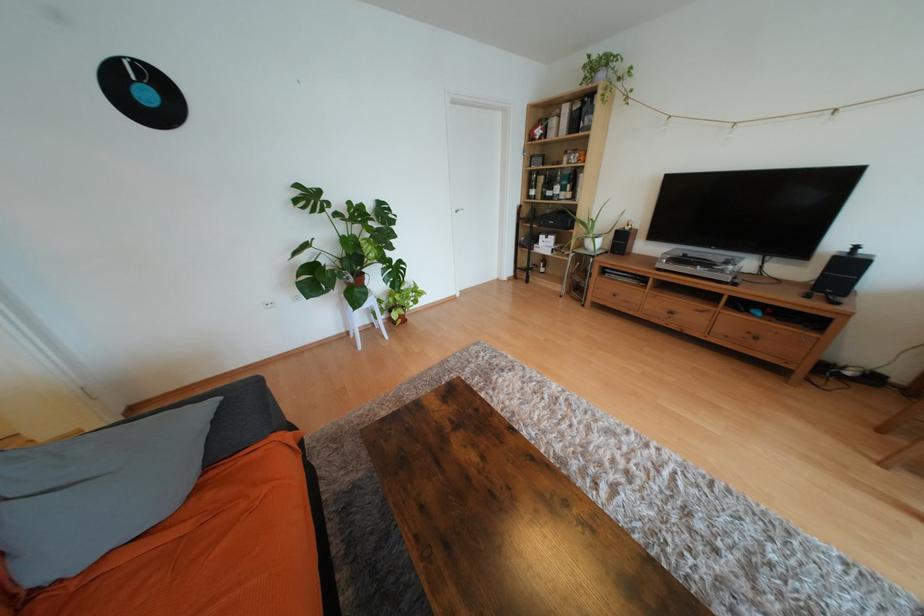
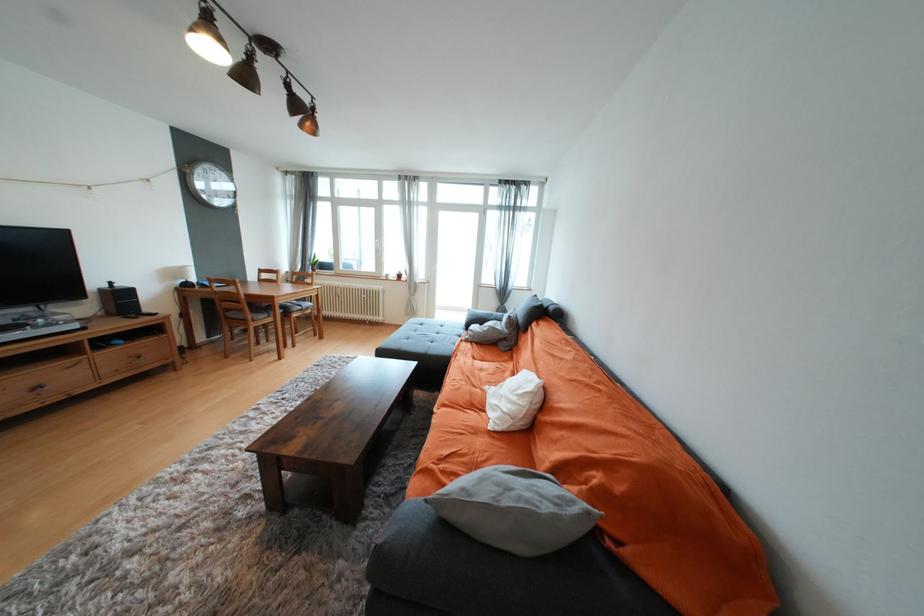
Locate, in the second image, the point that corresponds to (677,314) in the first image.

(44, 387)